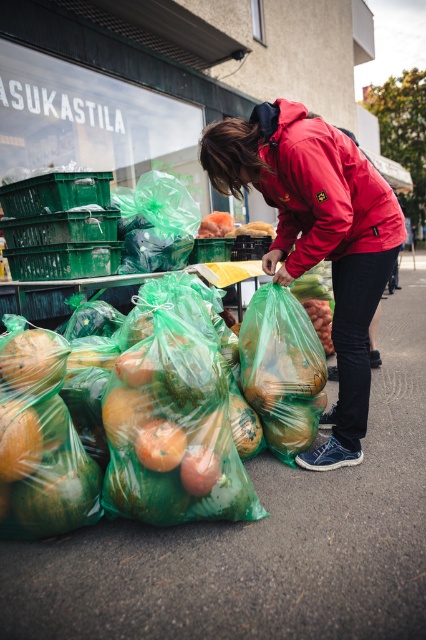
Question: From the image, what is the correct spatial relationship of matte red jacket at center in relation to orange matte plastic bag at center?

Choices:
 (A) above
 (B) below

Answer: (A)

Question: Among these objects, which one is farthest from the camera?

Choices:
 (A) matte red jacket at center
 (B) translucent plastic grocery bag at center
 (C) red matte jacket at center
 (D) orange matte plastic bag at center

Answer: (B)

Question: Is translucent plastic bag of fruits at center wider than red matte jacket at center?

Choices:
 (A) no
 (B) yes

Answer: (B)

Question: In this image, where is translucent plastic bag of fruits at center located relative to orange matte plastic bag at center?

Choices:
 (A) left
 (B) right

Answer: (A)

Question: Among these objects, which one is farthest from the camera?

Choices:
 (A) translucent plastic grocery bag at center
 (B) red matte jacket at center
 (C) translucent plastic bag of fruits at center
 (D) orange matte plastic bag at center

Answer: (A)

Question: Which point is farther from the camera taking this photo?

Choices:
 (A) (270, 157)
 (B) (368, 388)

Answer: (B)